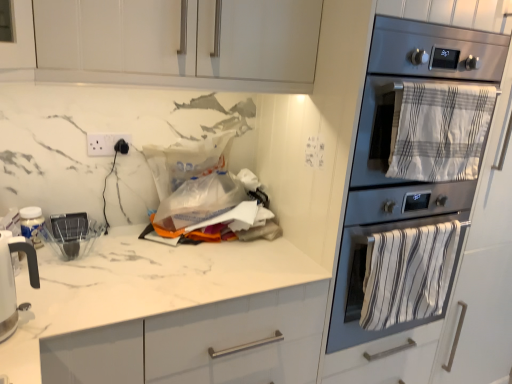
Question: Considering the relative sizes of white marble countertop at center and white glossy electric kettle at left in the image provided, is white marble countertop at center thinner than white glossy electric kettle at left?

Choices:
 (A) yes
 (B) no

Answer: (B)

Question: Does white marble countertop at center have a greater width compared to white glossy electric kettle at left?

Choices:
 (A) no
 (B) yes

Answer: (B)

Question: Is white marble countertop at center not within white glossy electric kettle at left?

Choices:
 (A) no
 (B) yes

Answer: (B)

Question: Does white marble countertop at center have a lesser height compared to white glossy electric kettle at left?

Choices:
 (A) no
 (B) yes

Answer: (A)

Question: From the image's perspective, is white marble countertop at center on top of white glossy electric kettle at left?

Choices:
 (A) no
 (B) yes

Answer: (A)

Question: Is white glossy electric kettle at left completely or partially inside white marble countertop at center?

Choices:
 (A) no
 (B) yes

Answer: (A)

Question: Is white marble countertop at center to the left of white plastic electric outlet at upper left from the viewer's perspective?

Choices:
 (A) no
 (B) yes

Answer: (A)

Question: Can you confirm if white marble countertop at center is shorter than white plastic electric outlet at upper left?

Choices:
 (A) no
 (B) yes

Answer: (A)

Question: From the image's perspective, is white marble countertop at center below white plastic electric outlet at upper left?

Choices:
 (A) yes
 (B) no

Answer: (A)

Question: From a real-world perspective, is white marble countertop at center physically below white plastic electric outlet at upper left?

Choices:
 (A) no
 (B) yes

Answer: (B)

Question: Can we say white marble countertop at center lies outside white plastic electric outlet at upper left?

Choices:
 (A) no
 (B) yes

Answer: (B)

Question: Is white marble countertop at center far from white plastic electric outlet at upper left?

Choices:
 (A) no
 (B) yes

Answer: (A)

Question: Does white glossy cabinet at upper center come in front of white marble countertop at center?

Choices:
 (A) yes
 (B) no

Answer: (B)